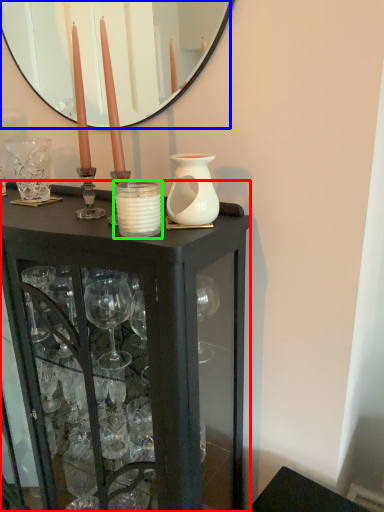
Question: Which object is the farthest from table (highlighted by a red box)? Choose among these: mirror (highlighted by a blue box) or candle holder (highlighted by a green box).

Choices:
 (A) mirror
 (B) candle holder

Answer: (A)